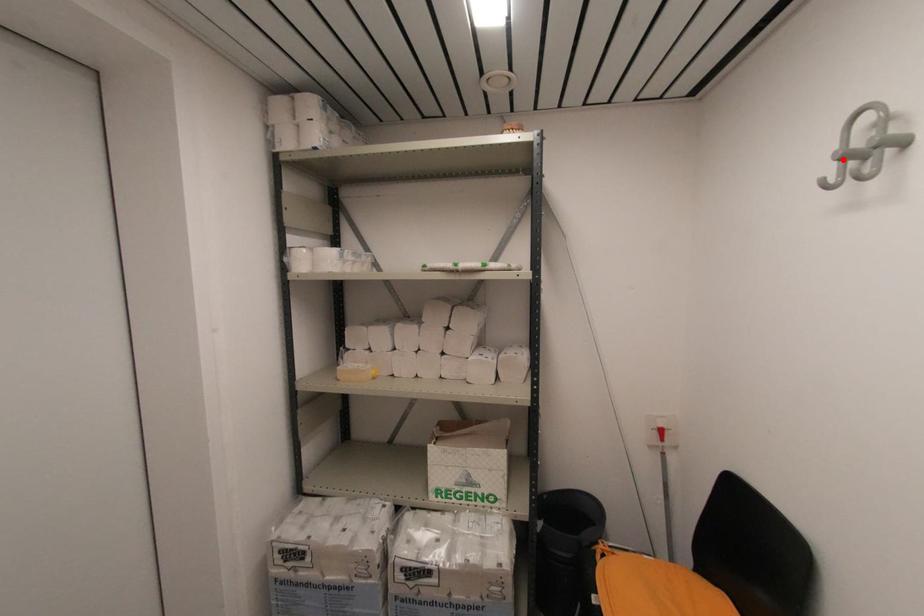
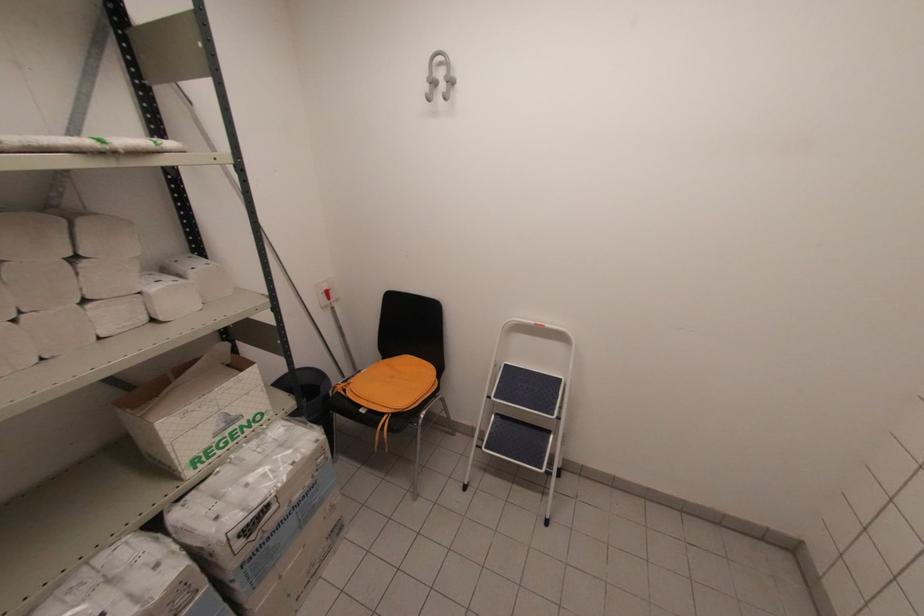
In the second image, find the point that corresponds to the highlighted location in the first image.

(431, 84)